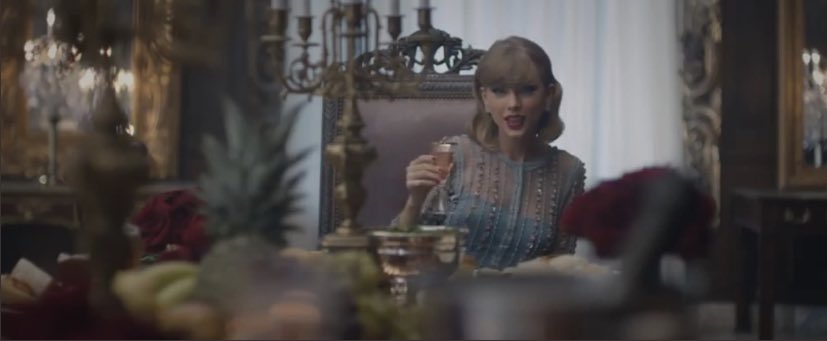
Identify the location of flower arrangement. The height and width of the screenshot is (341, 827). (164, 225).